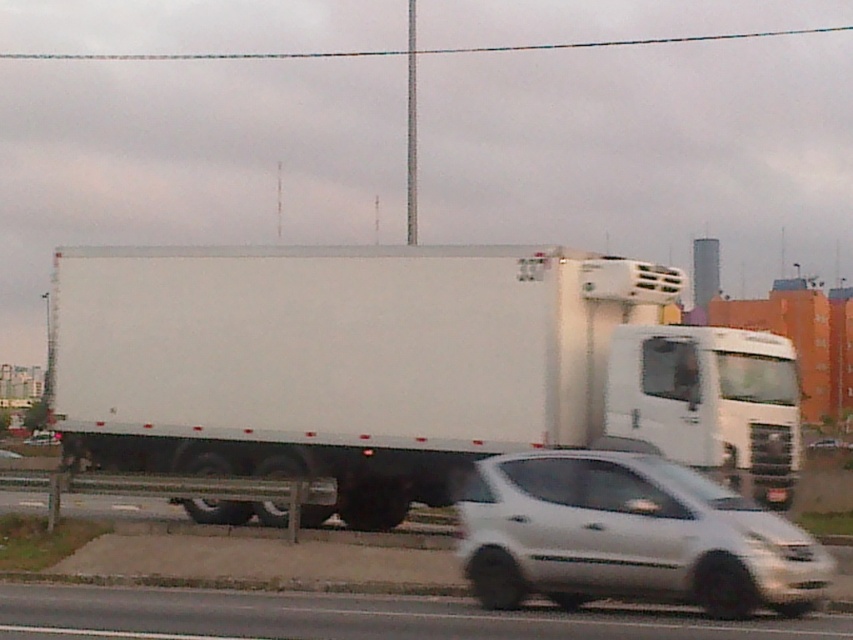
Question: Is white matte truck at center to the left of white matte car at lower right from the viewer's perspective?

Choices:
 (A) no
 (B) yes

Answer: (B)

Question: Observing the image, what is the correct spatial positioning of white matte truck at center in reference to white glossy car at lower center?

Choices:
 (A) left
 (B) right

Answer: (B)

Question: From the image, what is the correct spatial relationship of white matte car at lower right in relation to black plastic license plate at center?

Choices:
 (A) below
 (B) above

Answer: (B)

Question: Which object is the farthest from the white matte truck at center?

Choices:
 (A) white glossy car at lower center
 (B) black plastic license plate at center
 (C) white matte car at lower right

Answer: (C)

Question: Which object appears closest to the camera in this image?

Choices:
 (A) black plastic license plate at center
 (B) white glossy car at lower center
 (C) white matte car at lower right
 (D) white matte truck at center

Answer: (B)

Question: Which is nearer to the white glossy car at lower center?

Choices:
 (A) black plastic license plate at center
 (B) white matte truck at center

Answer: (B)